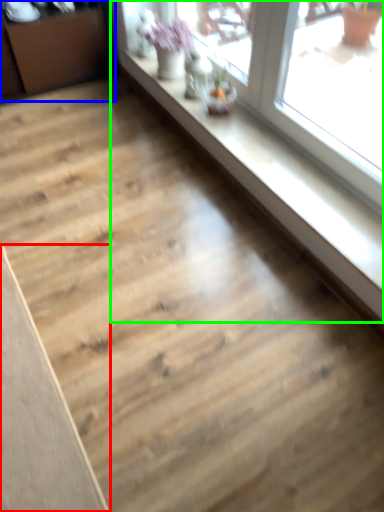
Question: Estimate the real-world distances between objects in this image. Which object is closer to plank (highlighted by a red box), dresser (highlighted by a blue box) or window (highlighted by a green box)?

Choices:
 (A) dresser
 (B) window

Answer: (B)